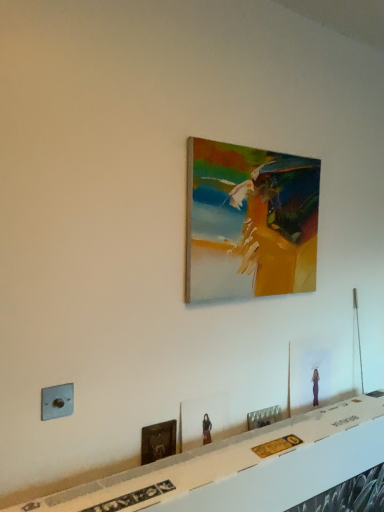
Question: Is the surface of white glossy table at lower center in direct contact with matte wooden picture frame at center, the third picture frame in the bottom-to-top sequence?

Choices:
 (A) no
 (B) yes

Answer: (A)

Question: Does white glossy table at lower center have a lesser width compared to matte wooden picture frame at center, marked as the third picture frame in a top-to-bottom arrangement?

Choices:
 (A) no
 (B) yes

Answer: (A)

Question: Does white glossy table at lower center have a greater height compared to matte wooden picture frame at center, marked as the third picture frame in a top-to-bottom arrangement?

Choices:
 (A) no
 (B) yes

Answer: (B)

Question: Could you tell me if white glossy table at lower center is turned towards matte wooden picture frame at center, the third picture frame in the bottom-to-top sequence?

Choices:
 (A) no
 (B) yes

Answer: (A)

Question: Is there a large distance between white glossy table at lower center and matte wooden picture frame at center, marked as the third picture frame in a top-to-bottom arrangement?

Choices:
 (A) no
 (B) yes

Answer: (A)

Question: Would you say white glossy table at lower center is to the left or to the right of matte glass picture frame at lower right, which is counted as the second picture frame, starting from the top, in the picture?

Choices:
 (A) right
 (B) left

Answer: (B)

Question: Is white glossy table at lower center bigger or smaller than matte glass picture frame at lower right, which is counted as the second picture frame, starting from the top?

Choices:
 (A) small
 (B) big

Answer: (B)

Question: Choose the correct answer: Is white glossy table at lower center inside matte glass picture frame at lower right, which is counted as the second picture frame, starting from the top, or outside it?

Choices:
 (A) inside
 (B) outside

Answer: (B)

Question: From a real-world perspective, is white glossy table at lower center above or below matte glass picture frame at lower right, positioned as the 4th picture frame in bottom-to-top order?

Choices:
 (A) above
 (B) below

Answer: (B)

Question: In terms of height, does white glossy table at lower center look taller or shorter compared to matte wooden picture frame at center, marked as the third picture frame in a top-to-bottom arrangement?

Choices:
 (A) short
 (B) tall

Answer: (B)

Question: Is white glossy table at lower center bigger or smaller than matte wooden picture frame at center, the third picture frame in the bottom-to-top sequence?

Choices:
 (A) small
 (B) big

Answer: (B)

Question: In the image, is white glossy table at lower center positioned in front of or behind matte wooden picture frame at center, the third picture frame in the bottom-to-top sequence?

Choices:
 (A) front
 (B) behind

Answer: (A)

Question: From a real-world perspective, is white glossy table at lower center above or below matte wooden picture frame at center, the third picture frame in the bottom-to-top sequence?

Choices:
 (A) above
 (B) below

Answer: (B)

Question: Is point (195, 412) closer or farther from the camera than point (49, 409)?

Choices:
 (A) closer
 (B) farther

Answer: (B)

Question: From a real-world perspective, is matte wooden picture frame at center, marked as the third picture frame in a top-to-bottom arrangement, positioned above or below metallic gray electric outlet at lower left?

Choices:
 (A) above
 (B) below

Answer: (B)